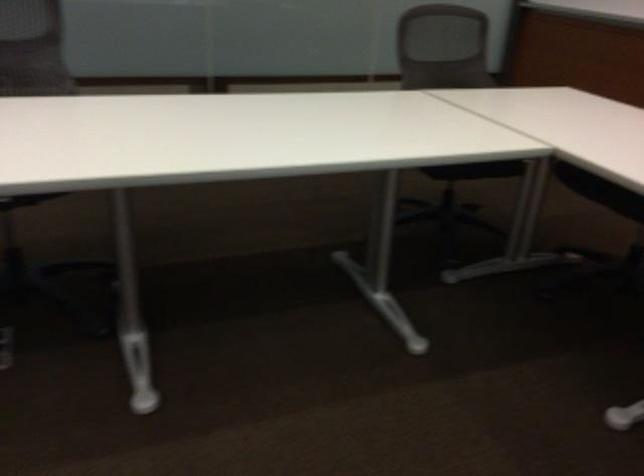
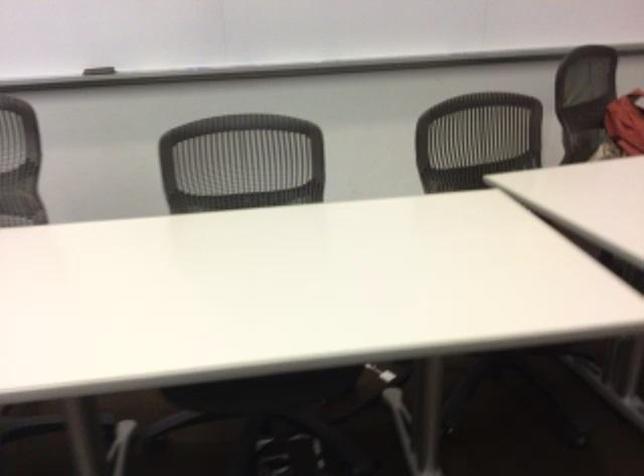
The images are taken continuously from a first-person perspective. In which direction is your viewpoint rotating?

The camera's rotation is toward left-down.